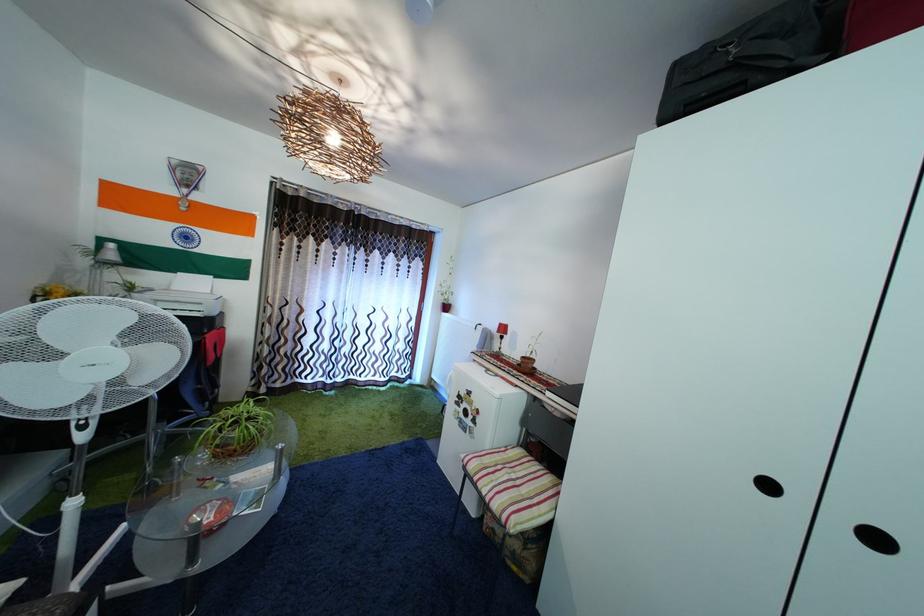
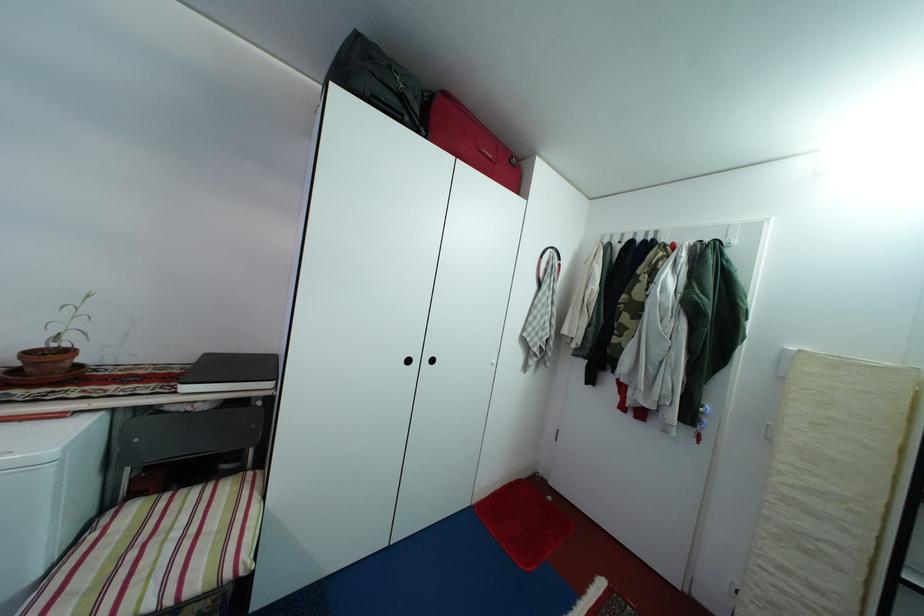
Where in the second image is the point corresponding to [531,365] from the first image?

(38, 361)